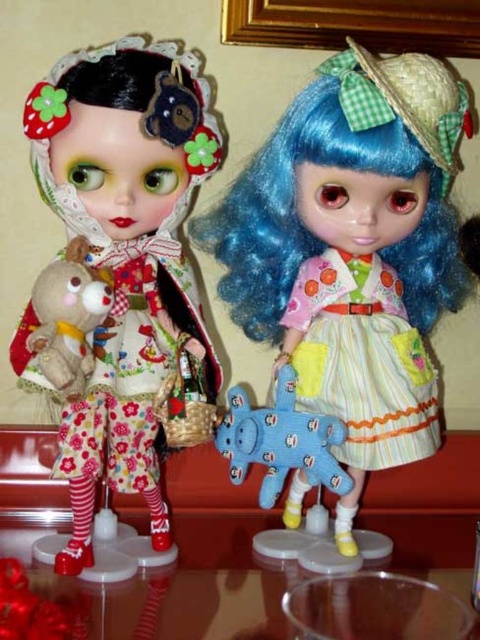
Question: Which point is closer to the camera?

Choices:
 (A) (39, 275)
 (B) (21, 352)
 (C) (300, 449)
 (D) (319, 211)

Answer: (C)

Question: Which object is farther from the camera taking this photo?

Choices:
 (A) pastel striped fabric dress at right
 (B) floral fabric doll at left

Answer: (A)

Question: Among these points, which one is farthest from the camera?

Choices:
 (A) (195, 630)
 (B) (239, 451)
 (C) (115, 292)

Answer: (B)

Question: From the image, what is the correct spatial relationship of floral fabric doll at left in relation to fluffy beige teddy bear at left?

Choices:
 (A) below
 (B) above

Answer: (B)

Question: From the image, what is the correct spatial relationship of floral fabric dress at left in relation to transparent plastic table at lower center?

Choices:
 (A) below
 (B) above

Answer: (B)

Question: Is matte blue fabric doll at center to the left of transparent plastic table at lower center from the viewer's perspective?

Choices:
 (A) no
 (B) yes

Answer: (A)